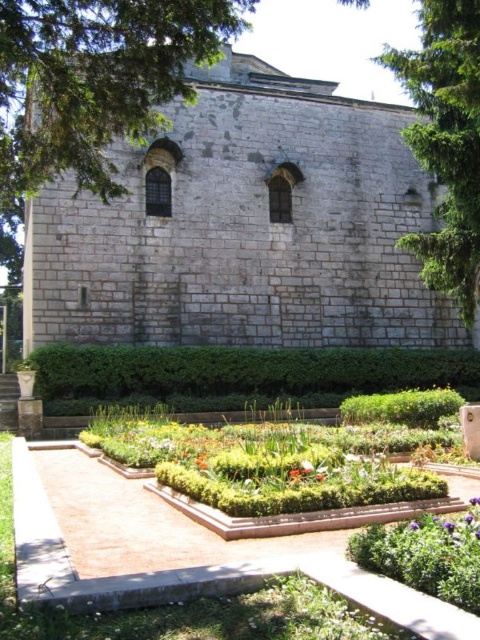
You are a landscape architect designing a new pathway between the white stone chapel at center and the green leafy tree at upper right. The pathway must be at least 12 meters long to accommodate a walking trail. Can the proposed pathway fit between them?

The distance between the white stone chapel at center and the green leafy tree at upper right is 14.09 meters, which is longer than the required 12 meters. Therefore, the pathway can easily fit between them.